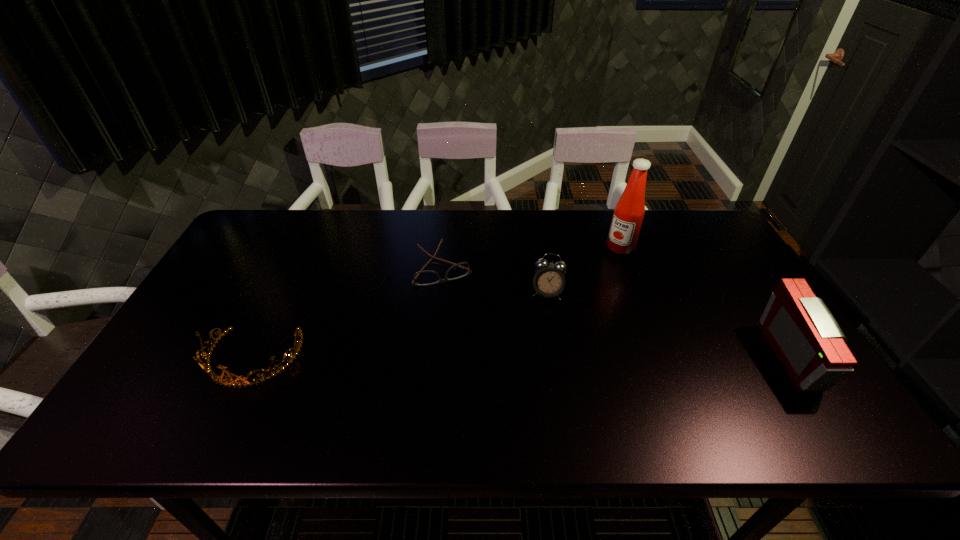
Where is `the leftmost object`? the leftmost object is located at coordinates (267, 374).

Locate an element on the screen. the second shortest object is located at coordinates (267, 374).

This screenshot has width=960, height=540. In order to click on the rightmost object in this screenshot , I will do `click(805, 337)`.

Identify the location of camera. (805, 337).

The height and width of the screenshot is (540, 960). I want to click on the third object from right to left, so [549, 279].

Find the location of a particular element. the third shortest object is located at coordinates (549, 279).

You are a GUI agent. You are given a task and a screenshot of the screen. Output one action in this format:
    pyautogui.click(x=<x>, y=<y>)
    Task: Click on the fourth object from right to left
    
    Given the screenshot: What is the action you would take?
    pyautogui.click(x=424, y=277)

At what (x,y) coordinates should I click in order to perform the action: click on spectacles. Please return your answer as a coordinate pair (x, y). This screenshot has height=540, width=960. Looking at the image, I should click on (424, 277).

You are a GUI agent. You are given a task and a screenshot of the screen. Output one action in this format:
    pyautogui.click(x=<x>, y=<y>)
    Task: Click on the condiment
    The image size is (960, 540).
    Given the screenshot: What is the action you would take?
    pyautogui.click(x=629, y=211)

Identify the location of the second object from right to left. This screenshot has width=960, height=540. (629, 211).